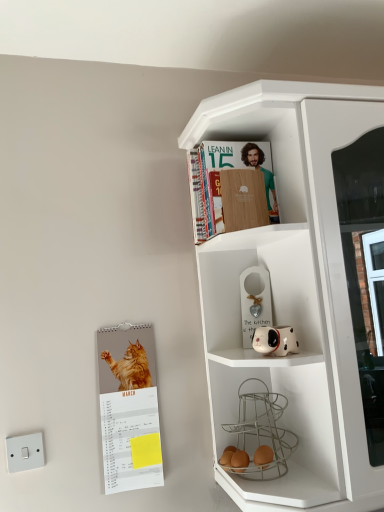
Locate an element on the screen. This screenshot has width=384, height=512. free location above wooden cover book at upper center (from a real-world perspective) is located at coordinates (230, 135).